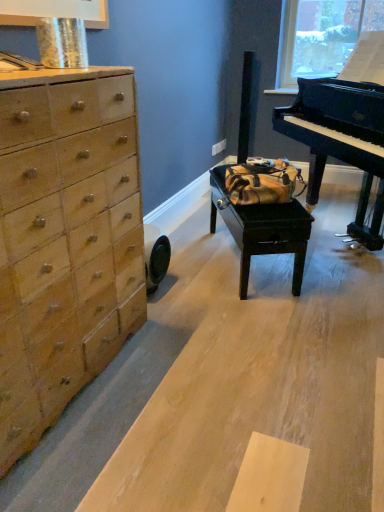
At what (x,y) coordinates should I click in order to perform the action: click on vacant area that is situated to the right of light brown wood chest of drawers at left. Please return your answer as a coordinate pair (x, y). This screenshot has width=384, height=512. Looking at the image, I should click on (198, 384).